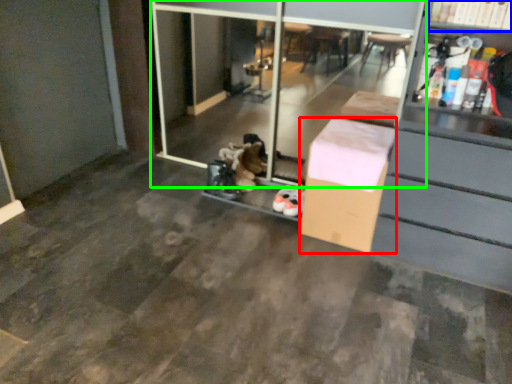
Question: Considering the real-world distances, which object is closest to box (highlighted by a red box)? shelf (highlighted by a blue box) or screen door (highlighted by a green box).

Choices:
 (A) shelf
 (B) screen door

Answer: (A)